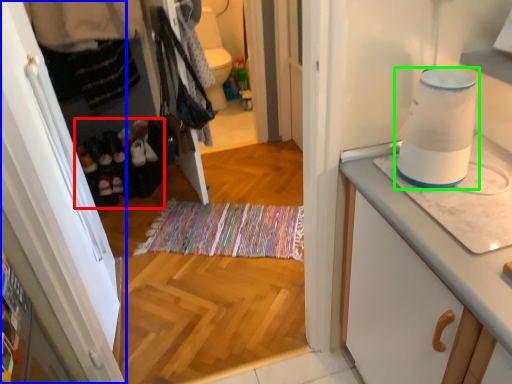
Question: Considering the real-world distances, which object is closest to footwear (highlighted by a red box)? cabinetry (highlighted by a blue box) or home appliance (highlighted by a green box).

Choices:
 (A) cabinetry
 (B) home appliance

Answer: (A)